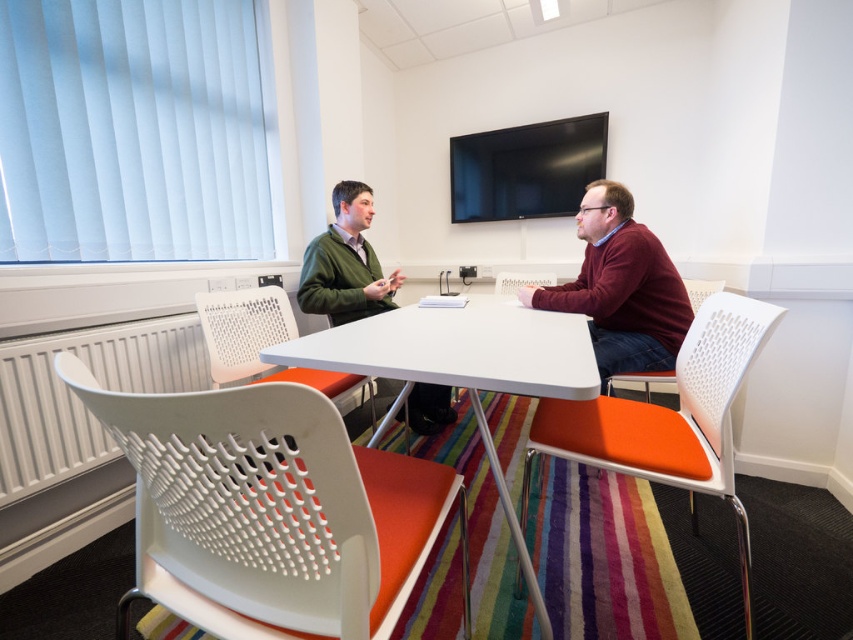
You are a visitor entering the office and need to sit down. You see the white plastic chair at center and the white perforated chair at right. Which chair is taller?

The white plastic chair at center is much taller than the white perforated chair at right.

You are standing in the office and want to place a small plant between the two points, point (613, 182) and point (296, 333). Which point should you place it closer to if you want the plant to be closer to the camera?

You should place the plant closer to point (613, 182) because it is closer to the camera than point (296, 333).

You are organizing a small meeting in this office and need to place the maroon sweater at right and the white plastic chair at center in a specific arrangement. If you want to place an object that takes up more space between them, which object should you choose as the base?

The white plastic chair at center occupies more space than the maroon sweater at right, so you should choose the white plastic chair at center as the base to place the larger object between them.